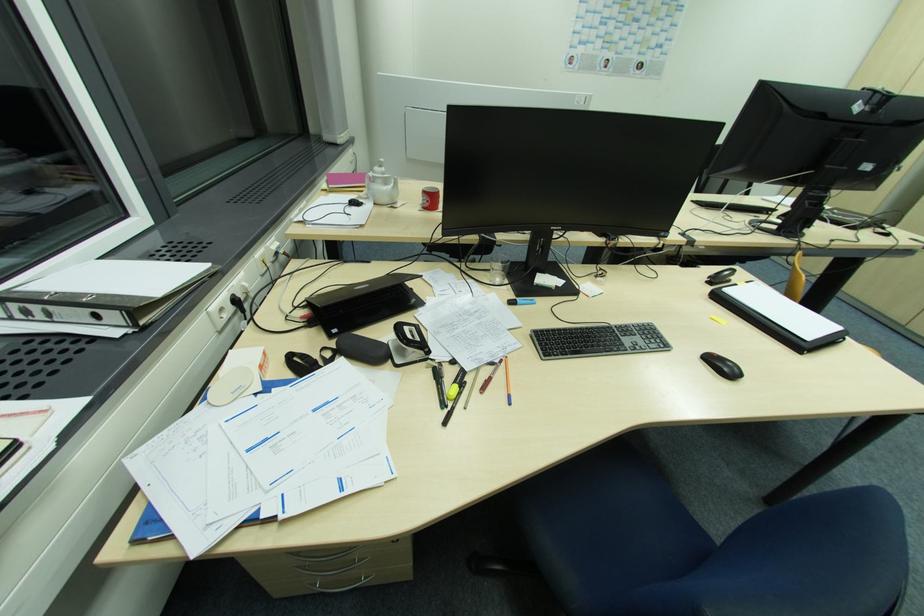
The width and height of the screenshot is (924, 616). What do you see at coordinates (637, 549) in the screenshot?
I see `a blue chair sitting surface` at bounding box center [637, 549].